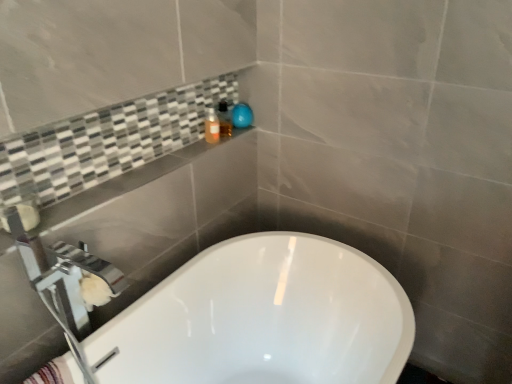
Question: Can you confirm if translucent plastic soap dispenser at upper center, the first toiletry positioned from the right, is positioned to the right of chrome metallic tap at upper left?

Choices:
 (A) no
 (B) yes

Answer: (B)

Question: Can you confirm if translucent plastic soap dispenser at upper center, marked as the second toiletry in a left-to-right arrangement, is bigger than chrome metallic tap at upper left?

Choices:
 (A) no
 (B) yes

Answer: (A)

Question: From the image's perspective, is translucent plastic soap dispenser at upper center, marked as the second toiletry in a left-to-right arrangement, on chrome metallic tap at upper left?

Choices:
 (A) yes
 (B) no

Answer: (A)

Question: Is translucent plastic soap dispenser at upper center, the first toiletry positioned from the right, to the left of chrome metallic tap at upper left from the viewer's perspective?

Choices:
 (A) no
 (B) yes

Answer: (A)

Question: Would you consider translucent plastic soap dispenser at upper center, marked as the second toiletry in a left-to-right arrangement, to be distant from chrome metallic tap at upper left?

Choices:
 (A) no
 (B) yes

Answer: (A)

Question: Is translucent plastic soap dispenser at upper center, marked as the second toiletry in a left-to-right arrangement, bigger or smaller than chrome metallic tap at upper left?

Choices:
 (A) small
 (B) big

Answer: (A)

Question: Looking at their shapes, would you say translucent plastic soap dispenser at upper center, marked as the second toiletry in a left-to-right arrangement, is wider or thinner than chrome metallic tap at upper left?

Choices:
 (A) wide
 (B) thin

Answer: (B)

Question: In terms of height, does translucent plastic soap dispenser at upper center, marked as the second toiletry in a left-to-right arrangement, look taller or shorter compared to chrome metallic tap at upper left?

Choices:
 (A) short
 (B) tall

Answer: (A)

Question: Which is correct: translucent plastic soap dispenser at upper center, marked as the second toiletry in a left-to-right arrangement, is inside chrome metallic tap at upper left, or outside of it?

Choices:
 (A) inside
 (B) outside

Answer: (B)

Question: Considering the positions of chrome metallic tap at upper left and matte orange bottle at upper center, which ranks as the first toiletry in left-to-right order, in the image, is chrome metallic tap at upper left bigger or smaller than matte orange bottle at upper center, which ranks as the first toiletry in left-to-right order,?

Choices:
 (A) big
 (B) small

Answer: (A)

Question: Considering the positions of chrome metallic tap at upper left and matte orange bottle at upper center, which is counted as the 2th toiletry, starting from the right, in the image, is chrome metallic tap at upper left taller or shorter than matte orange bottle at upper center, which is counted as the 2th toiletry, starting from the right,?

Choices:
 (A) short
 (B) tall

Answer: (B)

Question: From a real-world perspective, is chrome metallic tap at upper left above or below matte orange bottle at upper center, which is counted as the 2th toiletry, starting from the right?

Choices:
 (A) below
 (B) above

Answer: (A)

Question: In the image, is chrome metallic tap at upper left positioned in front of or behind matte orange bottle at upper center, which ranks as the first toiletry in left-to-right order?

Choices:
 (A) front
 (B) behind

Answer: (A)

Question: From the image's perspective, relative to matte orange bottle at upper center, which ranks as the first toiletry in left-to-right order, is striped cotton bath towel at lower left above or below?

Choices:
 (A) below
 (B) above

Answer: (A)

Question: Which is correct: striped cotton bath towel at lower left is inside matte orange bottle at upper center, which ranks as the first toiletry in left-to-right order, or outside of it?

Choices:
 (A) outside
 (B) inside

Answer: (A)